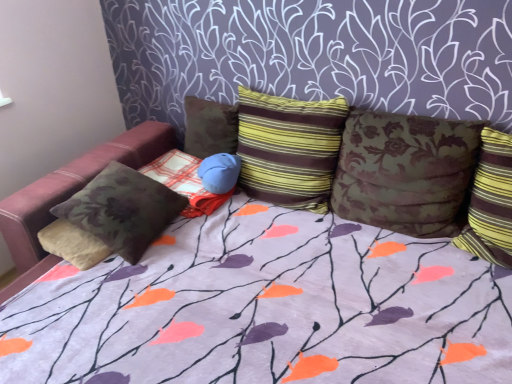
What do you see at coordinates (405, 171) in the screenshot? The height and width of the screenshot is (384, 512). I see `floral fabric pillow at center, the fifth pillow from the left` at bounding box center [405, 171].

Measure the distance between point (418,207) and camera.

Point (418,207) and camera are 1.70 meters apart from each other.

Locate an element on the screen. striped fabric pillow at right, the first pillow viewed from the right is located at coordinates (490, 202).

In order to click on floral fabric pillow at center, marked as the second pillow in a right-to-left arrangement in this screenshot , I will do `click(405, 171)`.

Is yellow striped pillow at center, placed as the 3th pillow when sorted from right to left, inside the boundaries of brown floral pillow at center, which appears as the third pillow when viewed from the left, or outside?

The correct answer is: outside.

Between point (323, 148) and point (229, 116), which one is positioned in front?

The point (323, 148) is closer to the camera.

From the image's perspective, is yellow striped pillow at center, placed as the 3th pillow when sorted from right to left, above brown floral pillow at center, the 4th pillow from the right?

No, from the image's perspective, yellow striped pillow at center, placed as the 3th pillow when sorted from right to left, is not on top of brown floral pillow at center, the 4th pillow from the right.

How many degrees apart are the facing directions of floral fabric pillow at center, the fifth pillow from the left, and brown floral fabric bean bag chair at left?

The angle between the facing direction of floral fabric pillow at center, the fifth pillow from the left, and the facing direction of brown floral fabric bean bag chair at left is 0.000178 degrees.

This screenshot has width=512, height=384. I want to click on bean bag chair below the floral fabric pillow at center, the fifth pillow from the left (from the image's perspective), so click(x=73, y=187).

From a real-world perspective, which object stands above the other?

floral fabric pillow at center, marked as the second pillow in a right-to-left arrangement, is physically above.

Who is bigger, floral fabric pillow at center, marked as the second pillow in a right-to-left arrangement, or brown floral fabric bean bag chair at left?

Bigger between the two is floral fabric pillow at center, marked as the second pillow in a right-to-left arrangement.

Considering the sizes of objects striped fabric pillow at right, the first pillow viewed from the right, and brown floral pillow at center, the 4th pillow from the right, in the image provided, who is bigger, striped fabric pillow at right, the first pillow viewed from the right, or brown floral pillow at center, the 4th pillow from the right,?

Bigger between the two is striped fabric pillow at right, the first pillow viewed from the right.

Considering the positions of points (506, 179) and (215, 148), is point (506, 179) closer to camera compared to point (215, 148)?

Yes, it is in front of point (215, 148).

Could you tell me if striped fabric pillow at right, the first pillow viewed from the right, is facing brown floral pillow at center, which appears as the third pillow when viewed from the left?

No, striped fabric pillow at right, the first pillow viewed from the right, is not aimed at brown floral pillow at center, which appears as the third pillow when viewed from the left.

Is striped fabric pillow at right, which is the 6th pillow from left to right, far away from brown floral pillow at center, which appears as the third pillow when viewed from the left?

Yes, striped fabric pillow at right, which is the 6th pillow from left to right, and brown floral pillow at center, which appears as the third pillow when viewed from the left, are located far from each other.

Would you say velvet floral pillow at left, which is counted as the sixth pillow, starting from the right, contains floral fabric pillow at center, the fifth pillow from the left?

No, velvet floral pillow at left, which is counted as the sixth pillow, starting from the right, does not contain floral fabric pillow at center, the fifth pillow from the left.

From the velvet floral pillow at left, which is counted as the sixth pillow, starting from the right, count 4th pillow to the right and point to it. Please provide its 2D coordinates.

[(405, 171)]

Between velvet floral pillow at left, placed as the first pillow when sorted from left to right, and floral fabric pillow at center, marked as the second pillow in a right-to-left arrangement, which one has larger size?

Bigger between the two is floral fabric pillow at center, marked as the second pillow in a right-to-left arrangement.

Is velvet floral pillow at left, which is counted as the sixth pillow, starting from the right, placed right next to floral fabric pillow at center, marked as the second pillow in a right-to-left arrangement?

No, velvet floral pillow at left, which is counted as the sixth pillow, starting from the right, is not next to floral fabric pillow at center, marked as the second pillow in a right-to-left arrangement.

Could you tell me if yellow striped pillow at center, the 4th pillow in the left-to-right sequence, is facing brown floral fabric bean bag chair at left?

Yes, yellow striped pillow at center, the 4th pillow in the left-to-right sequence, faces towards brown floral fabric bean bag chair at left.

Do you think yellow striped pillow at center, placed as the 3th pillow when sorted from right to left, is within brown floral fabric bean bag chair at left, or outside of it?

yellow striped pillow at center, placed as the 3th pillow when sorted from right to left, is spatially situated outside brown floral fabric bean bag chair at left.

Does point (344, 99) lie behind point (145, 153)?

No, it is not.

How far apart are yellow striped pillow at center, placed as the 3th pillow when sorted from right to left, and floral fabric pillow at center, marked as the second pillow in a right-to-left arrangement?

A distance of 27.39 centimeters exists between yellow striped pillow at center, placed as the 3th pillow when sorted from right to left, and floral fabric pillow at center, marked as the second pillow in a right-to-left arrangement.

Is yellow striped pillow at center, placed as the 3th pillow when sorted from right to left, taller or shorter than floral fabric pillow at center, the fifth pillow from the left?

Clearly, yellow striped pillow at center, placed as the 3th pillow when sorted from right to left, is taller compared to floral fabric pillow at center, the fifth pillow from the left.

Can you confirm if yellow striped pillow at center, placed as the 3th pillow when sorted from right to left, is wider than floral fabric pillow at center, marked as the second pillow in a right-to-left arrangement?

Yes.

Is yellow striped pillow at center, placed as the 3th pillow when sorted from right to left, looking in the opposite direction of floral fabric pillow at center, the fifth pillow from the left?

No, floral fabric pillow at center, the fifth pillow from the left, is not at the back of yellow striped pillow at center, placed as the 3th pillow when sorted from right to left.

Which of these two, yellow striped pillow at center, placed as the 3th pillow when sorted from right to left, or velvety brown pillow at center, acting as the second pillow starting from the left, stands taller?

yellow striped pillow at center, placed as the 3th pillow when sorted from right to left, is taller.

How far apart are yellow striped pillow at center, the 4th pillow in the left-to-right sequence, and velvety brown pillow at center, acting as the second pillow starting from the left?

yellow striped pillow at center, the 4th pillow in the left-to-right sequence, and velvety brown pillow at center, acting as the second pillow starting from the left, are 13.31 inches apart from each other.

Find the location of a particular element. the 4th pillow directly beneath the yellow striped pillow at center, placed as the 3th pillow when sorted from right to left (from a real-world perspective) is located at coordinates (185, 182).

From the image's perspective, is yellow striped pillow at center, placed as the 3th pillow when sorted from right to left, below velvety brown pillow at center, positioned as the 5th pillow in right-to-left order?

Incorrect, from the image's perspective, yellow striped pillow at center, placed as the 3th pillow when sorted from right to left, is higher than velvety brown pillow at center, positioned as the 5th pillow in right-to-left order.

Where is `the 1st pillow to the left when counting from the yellow striped pillow at center, the 4th pillow in the left-to-right sequence`? The image size is (512, 384). the 1st pillow to the left when counting from the yellow striped pillow at center, the 4th pillow in the left-to-right sequence is located at coordinates (210, 127).

Locate an element on the screen. the 3rd pillow above the brown floral fabric bean bag chair at left (from the image's perspective) is located at coordinates (405, 171).

Estimate the real-world distances between objects in this image. Which object is closer to striped fabric pillow at right, the first pillow viewed from the right, floral fabric pillow at center, the fifth pillow from the left, or brown floral fabric bean bag chair at left?

floral fabric pillow at center, the fifth pillow from the left, is positioned closer to the anchor striped fabric pillow at right, the first pillow viewed from the right.

Looking at the image, which one is located closer to brown floral fabric bean bag chair at left, floral fabric pillow at center, the fifth pillow from the left, or striped fabric pillow at right, the first pillow viewed from the right?

Among the two, floral fabric pillow at center, the fifth pillow from the left, is located nearer to brown floral fabric bean bag chair at left.

Considering their positions, is velvet floral pillow at left, which is counted as the sixth pillow, starting from the right, positioned further to striped fabric pillow at right, the first pillow viewed from the right, than brown floral fabric bean bag chair at left?

brown floral fabric bean bag chair at left is further to striped fabric pillow at right, the first pillow viewed from the right.

Estimate the real-world distances between objects in this image. Which object is further from striped fabric pillow at right, the first pillow viewed from the right, yellow striped pillow at center, the 4th pillow in the left-to-right sequence, or floral fabric pillow at center, marked as the second pillow in a right-to-left arrangement?

Among the two, yellow striped pillow at center, the 4th pillow in the left-to-right sequence, is located further to striped fabric pillow at right, the first pillow viewed from the right.

Looking at the image, which one is located closer to striped fabric pillow at right, which is the 6th pillow from left to right, yellow striped pillow at center, the 4th pillow in the left-to-right sequence, or velvet floral pillow at left, placed as the first pillow when sorted from left to right?

The object closer to striped fabric pillow at right, which is the 6th pillow from left to right, is yellow striped pillow at center, the 4th pillow in the left-to-right sequence.

Based on their spatial positions, is brown floral pillow at center, the 4th pillow from the right, or yellow striped pillow at center, placed as the 3th pillow when sorted from right to left, closer to striped fabric pillow at right, the first pillow viewed from the right?

Among the two, yellow striped pillow at center, placed as the 3th pillow when sorted from right to left, is located nearer to striped fabric pillow at right, the first pillow viewed from the right.

Which object lies further to the anchor point yellow striped pillow at center, placed as the 3th pillow when sorted from right to left, striped fabric pillow at right, the first pillow viewed from the right, or floral fabric pillow at center, marked as the second pillow in a right-to-left arrangement?

striped fabric pillow at right, the first pillow viewed from the right.

Looking at the image, which one is located closer to yellow striped pillow at center, placed as the 3th pillow when sorted from right to left, brown floral fabric bean bag chair at left or velvety brown pillow at center, acting as the second pillow starting from the left?

velvety brown pillow at center, acting as the second pillow starting from the left.

Locate an element on the screen. bean bag chair between velvet floral pillow at left, placed as the first pillow when sorted from left to right, and floral fabric pillow at center, the fifth pillow from the left, in the horizontal direction is located at coordinates (73, 187).

The image size is (512, 384). Identify the location of pillow situated between brown floral pillow at center, which appears as the third pillow when viewed from the left, and floral fabric pillow at center, the fifth pillow from the left, from left to right. (289, 148).

Find the location of `pillow situated between yellow striped pillow at center, placed as the 3th pillow when sorted from right to left, and striped fabric pillow at right, which is the 6th pillow from left to right, from left to right`. pillow situated between yellow striped pillow at center, placed as the 3th pillow when sorted from right to left, and striped fabric pillow at right, which is the 6th pillow from left to right, from left to right is located at coordinates (405, 171).

This screenshot has height=384, width=512. What are the coordinates of `pillow situated between velvety brown pillow at center, acting as the second pillow starting from the left, and yellow striped pillow at center, the 4th pillow in the left-to-right sequence, from left to right` in the screenshot? It's located at (210, 127).